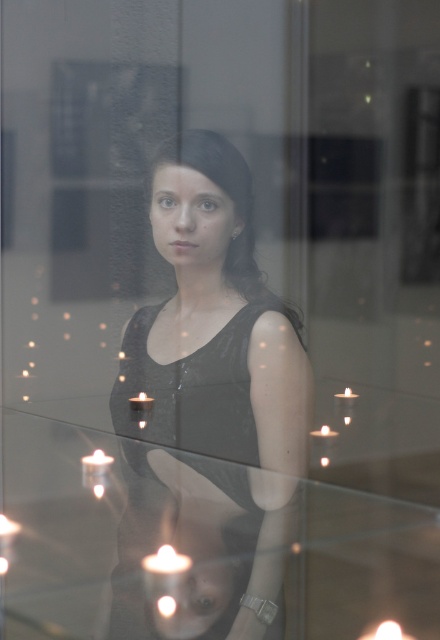
Between matte black dress at center and black velvet dress at center, which one appears on the left side from the viewer's perspective?

From the viewer's perspective, matte black dress at center appears more on the left side.

You are a GUI agent. You are given a task and a screenshot of the screen. Output one action in this format:
    pyautogui.click(x=<x>, y=<y>)
    Task: Click on the matte black dress at center
    
    Given the screenshot: What is the action you would take?
    pyautogui.click(x=211, y=410)

Describe the element at coordinates (211, 410) in the screenshot. Image resolution: width=440 pixels, height=640 pixels. I see `matte black dress at center` at that location.

Is matte black dress at center thinner than white wax candle at lower left?

No, matte black dress at center is not thinner than white wax candle at lower left.

Find the location of a particular element. The width and height of the screenshot is (440, 640). matte black dress at center is located at coordinates (211, 410).

Locate an element on the screen. Image resolution: width=440 pixels, height=640 pixels. matte black dress at center is located at coordinates (211, 410).

Which of these two, white wax candle at lower center or white wax candle at upper right, stands shorter?

Standing shorter between the two is white wax candle at lower center.

Can you confirm if white wax candle at lower center is positioned above white wax candle at upper right?

No.

Looking at this image, measure the distance between white wax candle at lower center and camera.

A distance of 37.80 inches exists between white wax candle at lower center and camera.

Identify the location of white wax candle at lower center. (167, 561).